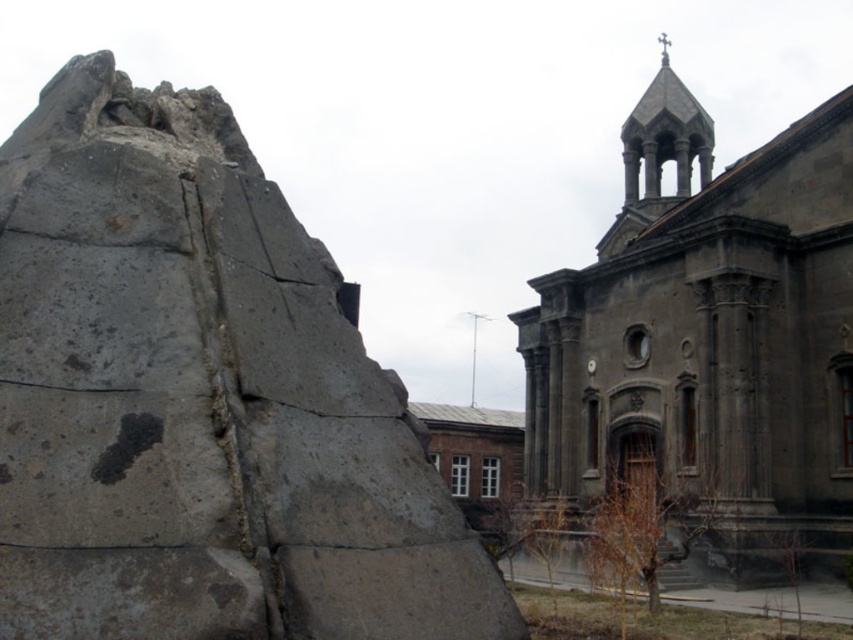
You are an architect analyzing the spatial relationship between the gray rough stone at left and the dark gray stone church at center. Which object is positioned to the left of the other?

The gray rough stone at left is positioned to the left of the dark gray stone church at center according to the description.

You are an archaeologist examining the image. You notice the gray rough stone at left and the dark gray stone church at center. Which object is closer to you in the scene?

The gray rough stone at left is closer to you because it is in front of the dark gray stone church at center.